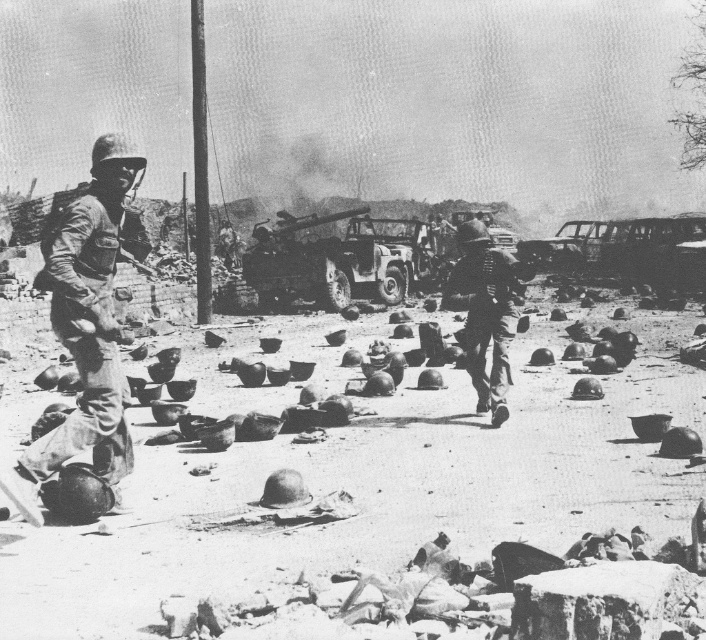
Can you confirm if metallic helmet at left is positioned to the left of metallic matte tank at center?

Yes, metallic helmet at left is to the left of metallic matte tank at center.

In the scene shown: Is metallic helmet at left behind metallic matte tank at center?

That is False.

Find the location of a particular element. This screenshot has height=640, width=706. metallic helmet at left is located at coordinates (90, 317).

Between metallic matte tank at center and metallic helmet at center, which one appears on the right side from the viewer's perspective?

Positioned to the right is metallic helmet at center.

Is metallic matte tank at center closer to camera compared to metallic helmet at center?

No, it is not.

At what (x,y) coordinates should I click in order to perform the action: click on metallic matte tank at center. Please return your answer as a coordinate pair (x, y). Looking at the image, I should click on (333, 259).

Does metallic helmet at left appear under metallic helmet at center?

Actually, metallic helmet at left is above metallic helmet at center.

Is point (109, 292) farther from camera compared to point (481, 285)?

No, it is in front of (481, 285).

Locate an element on the screen. metallic helmet at left is located at coordinates (90, 317).

Where is `metallic helmet at left`? This screenshot has width=706, height=640. metallic helmet at left is located at coordinates (90, 317).